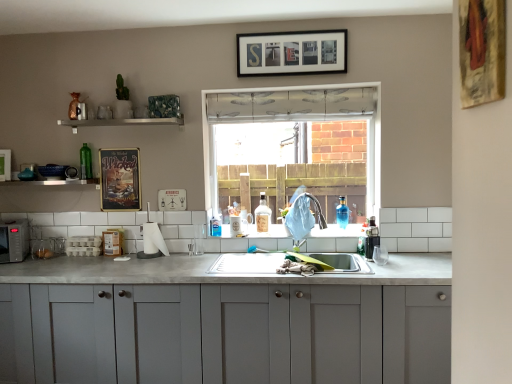
Question: Considering the positions of white glossy shelf at upper center, which is the first window sill in right-to-left order, and blue glass bottle at sink, which appears as the 1th bottle when viewed from the right, in the image, is white glossy shelf at upper center, which is the first window sill in right-to-left order, bigger or smaller than blue glass bottle at sink, which appears as the 1th bottle when viewed from the right,?

Choices:
 (A) small
 (B) big

Answer: (B)

Question: Choose the correct answer: Is white glossy shelf at upper center, which is counted as the 2th window sill, starting from the bottom, inside blue glass bottle at sink, which appears as the 1th bottle when viewed from the right, or outside it?

Choices:
 (A) inside
 (B) outside

Answer: (B)

Question: Estimate the real-world distances between objects in this image. Which object is closer to the green glass bottle at upper left, acting as the third bottle starting from the right?

Choices:
 (A) black matte microwave at left
 (B) clear glass bottle at sink, the 2th bottle in the right-to-left sequence
 (C) white glossy shelf at upper center, which ranks as the first window sill in top-to-bottom order
 (D) transparent plastic window at center
 (E) matte gray cabinets at center

Answer: (C)

Question: Estimate the real-world distances between objects in this image. Which object is farther from the transparent plastic window at center?

Choices:
 (A) satin silver faucet at sink center
 (B) wooden framed artwork at upper right, which appears as the first picture frame when viewed from the right
 (C) metallic poster at upper left, the 3th picture frame viewed from the front
 (D) clear glass bottle at sink, the second bottle in the left-to-right sequence
 (E) white tile at lower center, which is counted as the first window sill, starting from the bottom

Answer: (B)